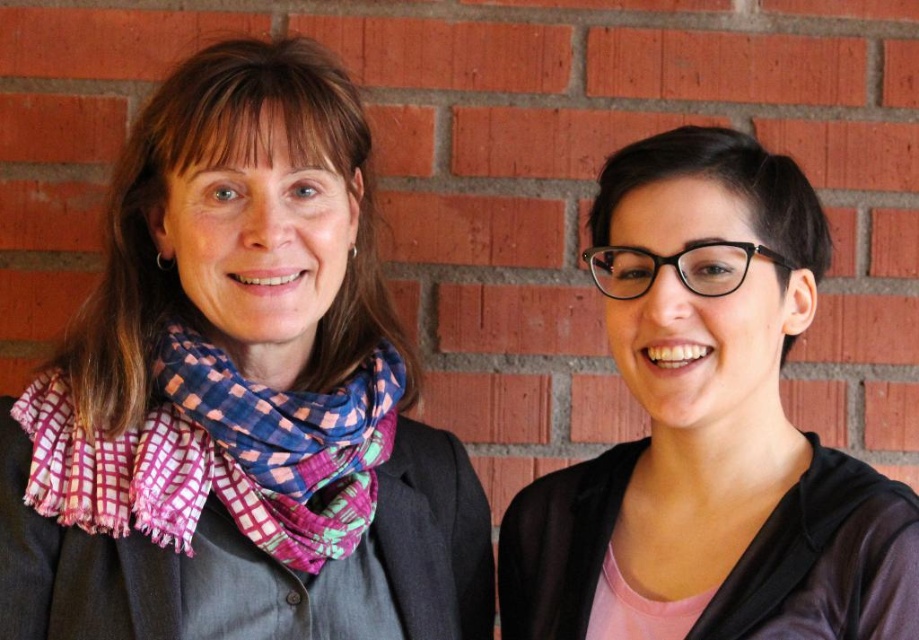
You are a fashion designer observing two scarves worn by two people in the image. The first person has a multicolored scarf at left, and the second has a multicolored woven scarf at left. Which scarf is bigger?

The multicolored scarf at left is larger in size compared to the multicolored woven scarf at left.

You are a photographer trying to capture the perfect shot of the two people in the image. You want to ensure that the multicolored scarf at left is centered in the frame. Given that the scarf is represented by the point coordinates point (x=237, y=396), what adjustment should you make to the camera position to center the scarf?

To center the multicolored scarf at left represented by point (x=237, y=396), move the camera to the left so that the point aligns with the center of the frame.